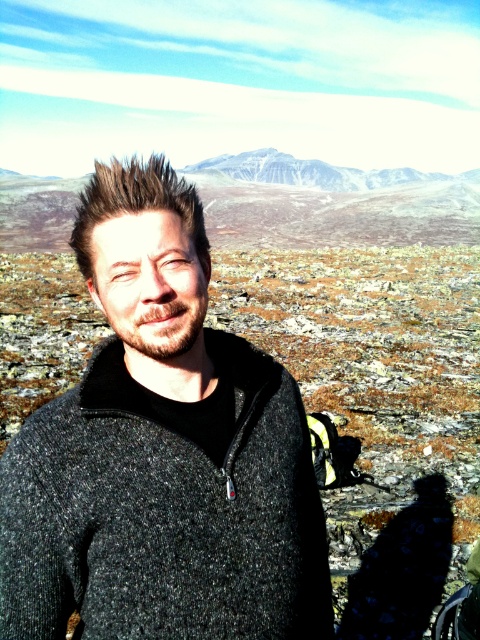
Between point (254, 397) and point (263, 148), which one is positioned behind?

Point (263, 148)

Can you confirm if charcoal wool sweater at center is positioned above snowy granite mountain at upper center?

Incorrect, charcoal wool sweater at center is not positioned above snowy granite mountain at upper center.

At what (x,y) coordinates should I click in order to perform the action: click on charcoal wool sweater at center. Please return your answer as a coordinate pair (x, y). This screenshot has width=480, height=640. Looking at the image, I should click on coord(162,452).